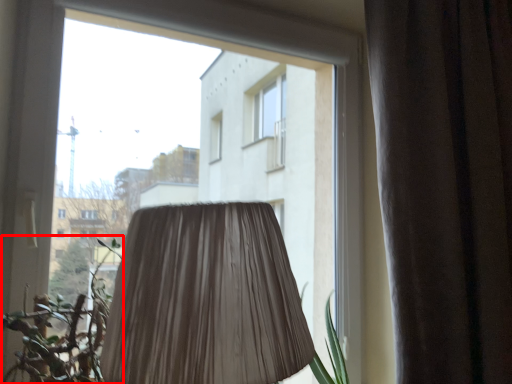
Question: Where is vegetation (annotated by the red box) located in relation to curtain in the image?

Choices:
 (A) left
 (B) right

Answer: (A)